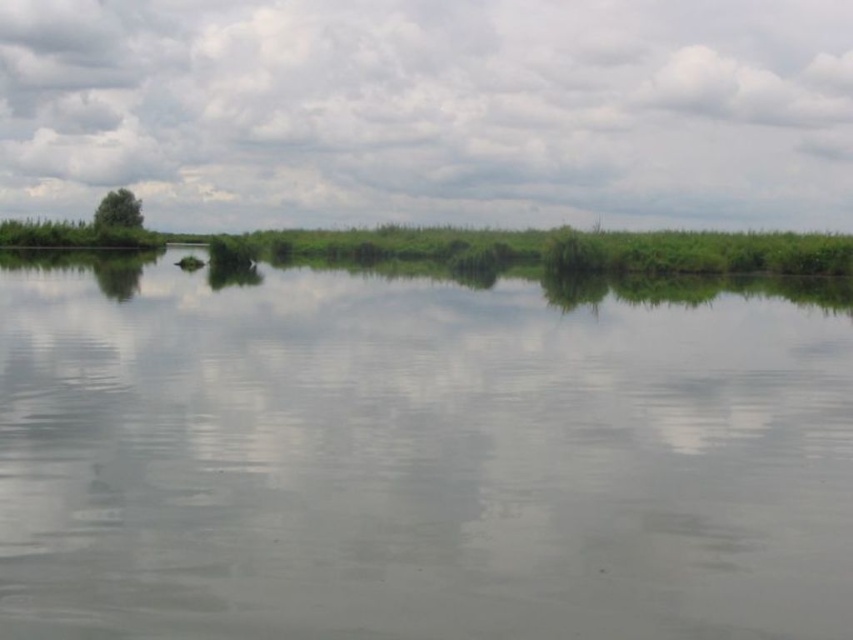
Question: Which object is the farthest from the green grassy river at center?

Choices:
 (A) white fluffy cloud at upper center
 (B) green leafy tree at upper left

Answer: (A)

Question: Which point is closer to the camera?

Choices:
 (A) green grassy river at center
 (B) green leafy tree at upper left

Answer: (A)

Question: Can you confirm if green grassy river at center is wider than white fluffy cloud at upper center?

Choices:
 (A) no
 (B) yes

Answer: (A)

Question: Is white fluffy cloud at upper center above green leafy tree at upper left?

Choices:
 (A) yes
 (B) no

Answer: (A)

Question: Which object is closer to the camera taking this photo?

Choices:
 (A) white fluffy cloud at upper center
 (B) green grassy river at center

Answer: (B)

Question: Considering the relative positions of green grassy river at center and white fluffy cloud at upper center in the image provided, where is green grassy river at center located with respect to white fluffy cloud at upper center?

Choices:
 (A) left
 (B) right

Answer: (A)